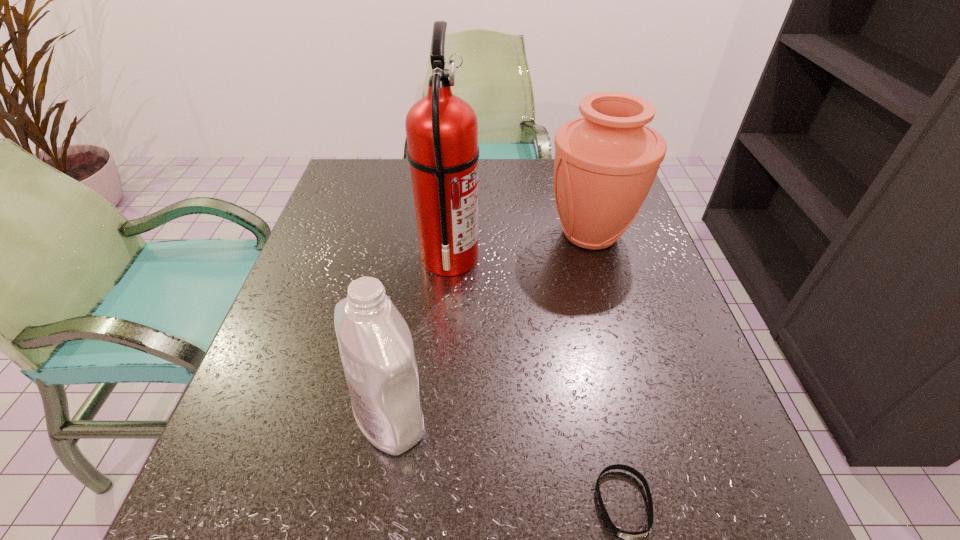
In the image, there is a desktop. Where is `free space at the far left corner`? This screenshot has width=960, height=540. free space at the far left corner is located at coordinates (339, 181).

Find the location of a particular element. free location at the near right corner is located at coordinates (649, 482).

The image size is (960, 540). I want to click on free space between the vase and the second nearest object, so click(491, 326).

The image size is (960, 540). In order to click on vacant space that's between the fire extinguisher and the vase in this screenshot , I will do `click(520, 246)`.

Where is `vacant area between the detergent and the fire extinguisher`? The image size is (960, 540). vacant area between the detergent and the fire extinguisher is located at coordinates (420, 338).

Where is `vacant area that lies between the vase and the tallest object`? Image resolution: width=960 pixels, height=540 pixels. vacant area that lies between the vase and the tallest object is located at coordinates (520, 246).

Where is `free space that is in between the detergent and the vase`? The width and height of the screenshot is (960, 540). free space that is in between the detergent and the vase is located at coordinates (491, 326).

Image resolution: width=960 pixels, height=540 pixels. Identify the location of vacant area between the vase and the detergent. (491, 326).

The image size is (960, 540). In order to click on vacant area between the second nearest object and the tallest object in this screenshot , I will do `click(420, 338)`.

Identify which object is the second closest to the detergent. Please provide its 2D coordinates. Your answer should be formatted as a tuple, i.e. [(x, y)], where the tuple contains the x and y coordinates of a point satisfying the conditions above.

[(632, 539)]